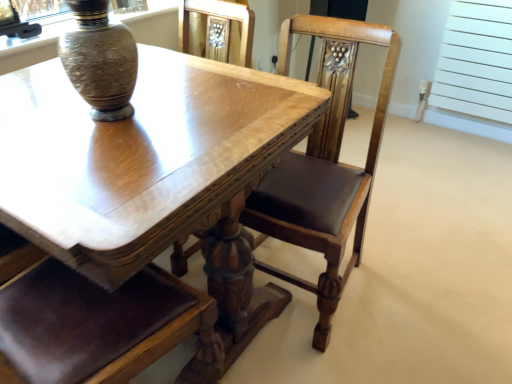
Question: Considering the relative sizes of white matte radiator at upper right and polished wood chair at center in the image provided, is white matte radiator at upper right bigger than polished wood chair at center?

Choices:
 (A) no
 (B) yes

Answer: (A)

Question: From the image's perspective, is white matte radiator at upper right beneath polished wood chair at center?

Choices:
 (A) no
 (B) yes

Answer: (A)

Question: From the image's perspective, is white matte radiator at upper right above polished wood chair at center?

Choices:
 (A) yes
 (B) no

Answer: (A)

Question: From a real-world perspective, does white matte radiator at upper right stand above polished wood chair at center?

Choices:
 (A) no
 (B) yes

Answer: (A)

Question: Is white matte radiator at upper right facing towards polished wood chair at center?

Choices:
 (A) yes
 (B) no

Answer: (A)

Question: Looking at the image, does polished wood chair at center seem bigger or smaller compared to white matte radiator at upper right?

Choices:
 (A) big
 (B) small

Answer: (A)

Question: From a real-world perspective, is polished wood chair at center physically located above or below white matte radiator at upper right?

Choices:
 (A) above
 (B) below

Answer: (A)

Question: Which is correct: polished wood chair at center is inside white matte radiator at upper right, or outside of it?

Choices:
 (A) inside
 (B) outside

Answer: (B)

Question: From the image's perspective, is polished wood chair at center located above or below white matte radiator at upper right?

Choices:
 (A) below
 (B) above

Answer: (A)

Question: In the image, is white matte radiator at upper right on the left side or the right side of speckled ceramic vase at upper left?

Choices:
 (A) left
 (B) right

Answer: (B)

Question: Looking at the image, does white matte radiator at upper right seem bigger or smaller compared to speckled ceramic vase at upper left?

Choices:
 (A) small
 (B) big

Answer: (B)

Question: Is white matte radiator at upper right in front of or behind speckled ceramic vase at upper left in the image?

Choices:
 (A) front
 (B) behind

Answer: (B)

Question: From a real-world perspective, is white matte radiator at upper right positioned above or below speckled ceramic vase at upper left?

Choices:
 (A) above
 (B) below

Answer: (B)

Question: In the image, is speckled ceramic vase at upper left positioned in front of or behind shiny wood table at center?

Choices:
 (A) behind
 (B) front

Answer: (A)

Question: From the image's perspective, is speckled ceramic vase at upper left located above or below shiny wood table at center?

Choices:
 (A) above
 (B) below

Answer: (A)